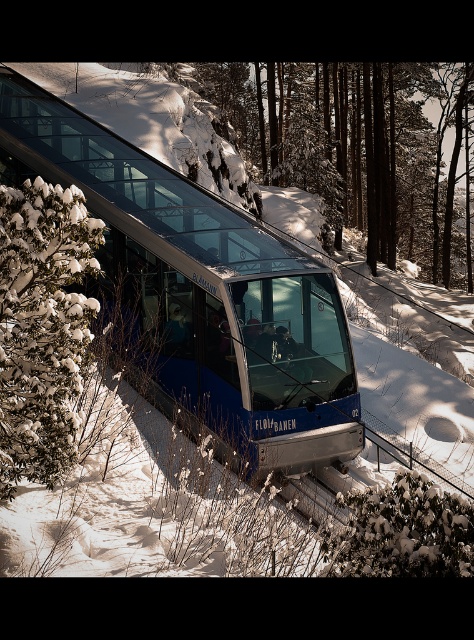
Question: Can you confirm if metallic blue train at center is thinner than snow-covered evergreen tree at center?

Choices:
 (A) yes
 (B) no

Answer: (A)

Question: Which object is closer to the camera taking this photo?

Choices:
 (A) green textured pine tree at left
 (B) metallic blue train at center
 (C) snow-covered evergreen tree at center

Answer: (A)

Question: Which object appears farthest from the camera in this image?

Choices:
 (A) metallic blue train at center
 (B) snow-covered evergreen tree at center
 (C) green textured pine tree at left

Answer: (B)

Question: Which of the following is the farthest from the observer?

Choices:
 (A) green textured pine tree at left
 (B) snow-covered evergreen tree at center
 (C) metallic blue train at center

Answer: (B)

Question: Does snow-covered evergreen tree at center have a larger size compared to green textured pine tree at left?

Choices:
 (A) no
 (B) yes

Answer: (B)

Question: Considering the relative positions of snow-covered evergreen tree at center and green textured pine tree at left in the image provided, where is snow-covered evergreen tree at center located with respect to green textured pine tree at left?

Choices:
 (A) right
 (B) left

Answer: (A)